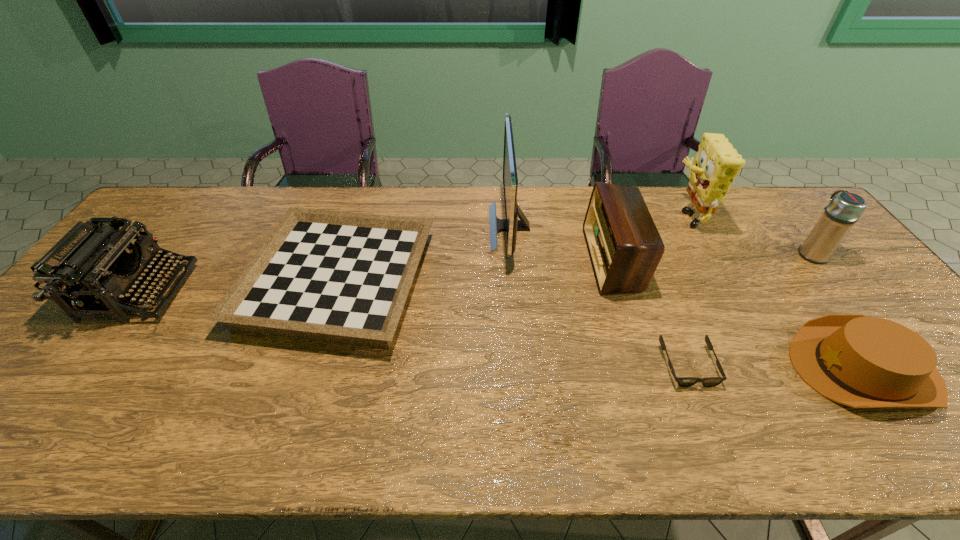
Find the location of `free space between the shortest object and the sixth object from right to left`. free space between the shortest object and the sixth object from right to left is located at coordinates (599, 296).

This screenshot has width=960, height=540. I want to click on free space between the thermos bottle and the shortest object, so click(750, 309).

Locate an element on the screen. This screenshot has width=960, height=540. object that is the nearest to the leftmost object is located at coordinates (343, 277).

Where is `object that stands as the fifth closest to the shortest object`? object that stands as the fifth closest to the shortest object is located at coordinates (844, 210).